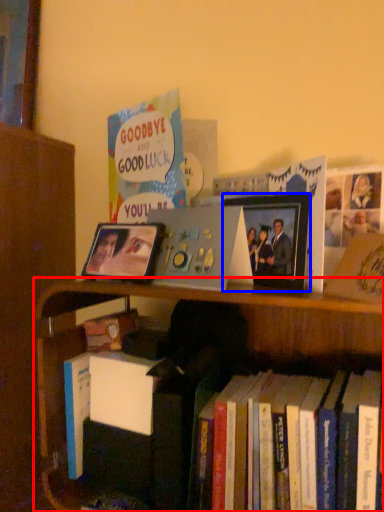
Question: Among these objects, which one is farthest to the camera, bookcase (highlighted by a red box) or picture frame (highlighted by a blue box)?

Choices:
 (A) bookcase
 (B) picture frame

Answer: (B)